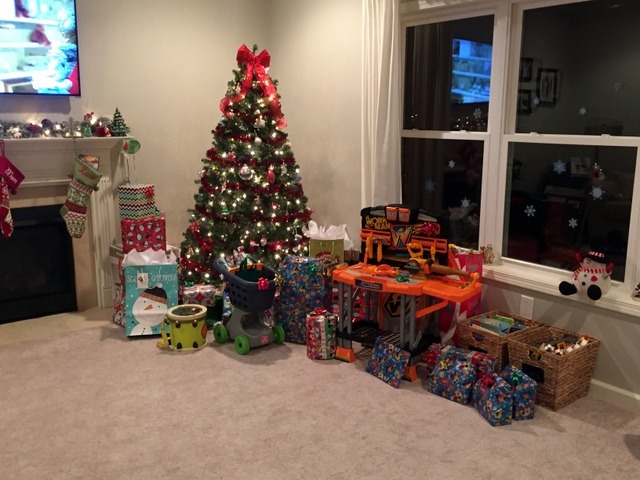
Locate an element on the screen. The width and height of the screenshot is (640, 480). tv is located at coordinates (45, 24).